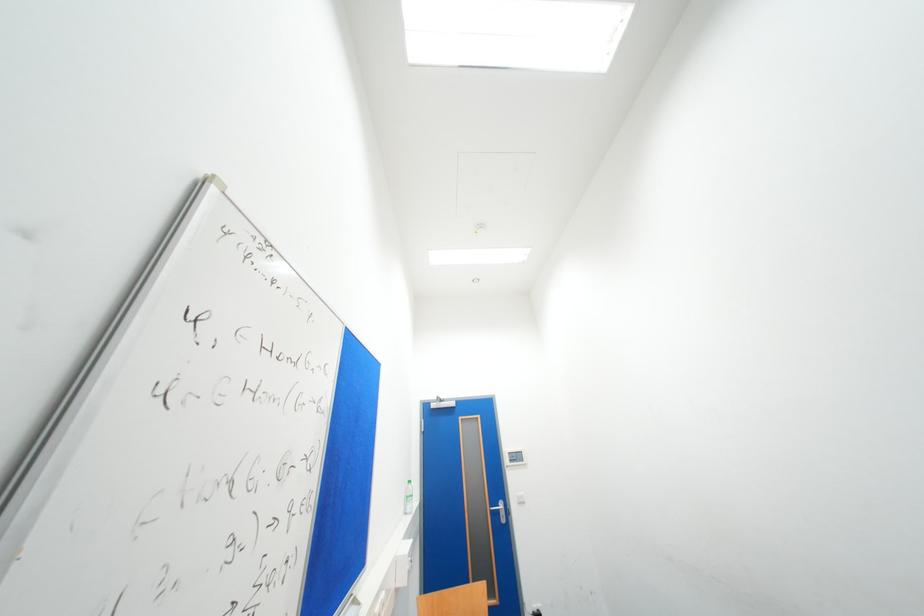
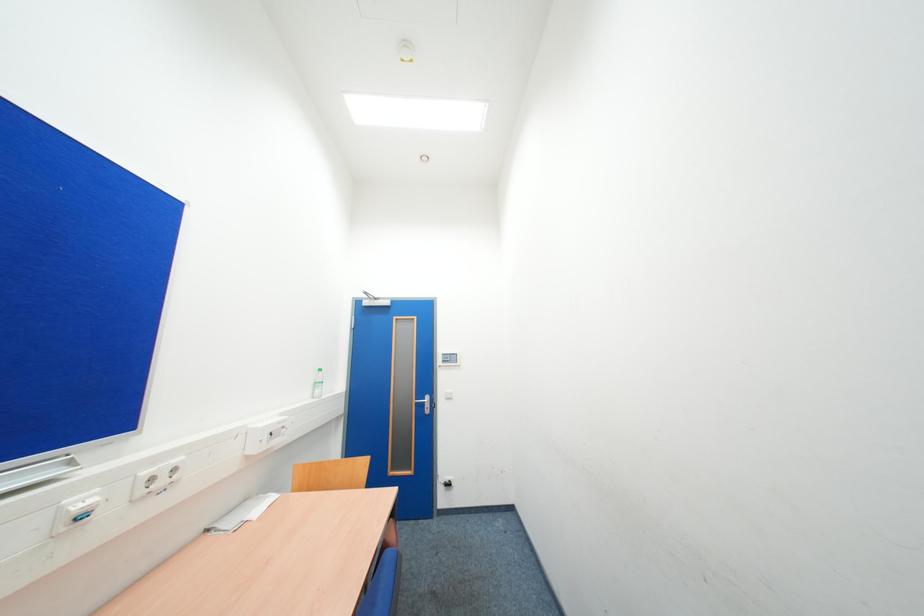
Question: How did the camera likely rotate?

Choices:
 (A) Left
 (B) Right
 (C) Up
 (D) Down

Answer: (D)